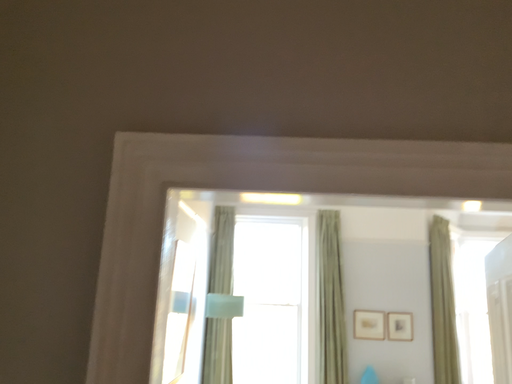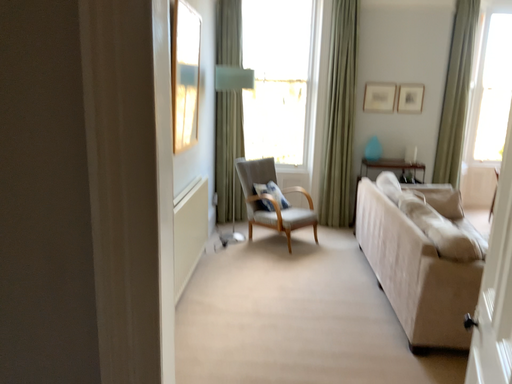
Question: How did the camera likely rotate when shooting the video?

Choices:
 (A) rotated upward
 (B) rotated downward

Answer: (B)